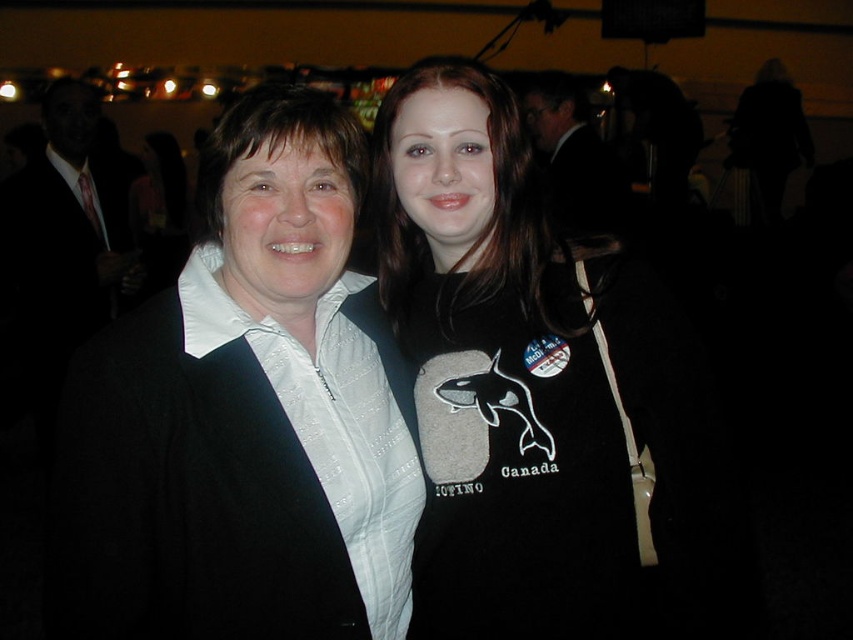
Question: Which is farther from the black fleece sweatshirt at center?

Choices:
 (A) black matte sweatshirt at center
 (B) matte black jacket at left

Answer: (B)

Question: Which object is positioned farthest from the matte black jacket at left?

Choices:
 (A) black fleece sweatshirt at center
 (B) black matte sweatshirt at center

Answer: (A)

Question: Is matte black jacket at left bigger than black matte sweatshirt at center?

Choices:
 (A) yes
 (B) no

Answer: (A)

Question: Which of these objects is positioned farthest from the black fleece sweatshirt at center?

Choices:
 (A) black matte sweatshirt at center
 (B) matte black jacket at left

Answer: (B)

Question: Observing the image, what is the correct spatial positioning of black matte sweatshirt at center in reference to black fleece sweatshirt at center?

Choices:
 (A) below
 (B) above

Answer: (B)

Question: Does black matte sweatshirt at center have a smaller size compared to black fleece sweatshirt at center?

Choices:
 (A) yes
 (B) no

Answer: (B)